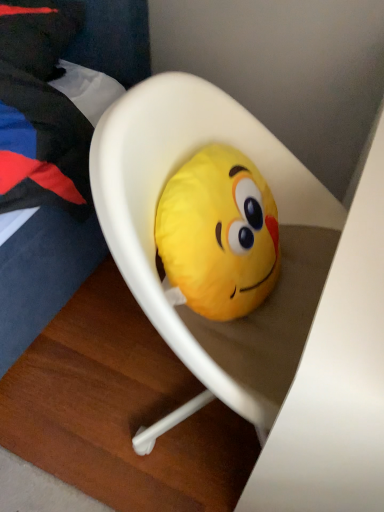
Question: From a real-world perspective, relative to soft yellow plush at center, is white plastic chair at center vertically above or below?

Choices:
 (A) below
 (B) above

Answer: (A)

Question: Is white plastic chair at center in front of or behind soft yellow plush at center in the image?

Choices:
 (A) behind
 (B) front

Answer: (B)

Question: Considering the positions of white plastic chair at center and soft yellow plush at center in the image, is white plastic chair at center wider or thinner than soft yellow plush at center?

Choices:
 (A) wide
 (B) thin

Answer: (A)

Question: From the image's perspective, relative to white plastic chair at center, is soft yellow plush at center above or below?

Choices:
 (A) above
 (B) below

Answer: (A)

Question: From their relative heights in the image, would you say soft yellow plush at center is taller or shorter than white plastic chair at center?

Choices:
 (A) tall
 (B) short

Answer: (B)

Question: From a real-world perspective, is soft yellow plush at center positioned above or below white plastic chair at center?

Choices:
 (A) below
 (B) above

Answer: (B)

Question: Based on their sizes in the image, would you say soft yellow plush at center is bigger or smaller than white plastic chair at center?

Choices:
 (A) small
 (B) big

Answer: (A)